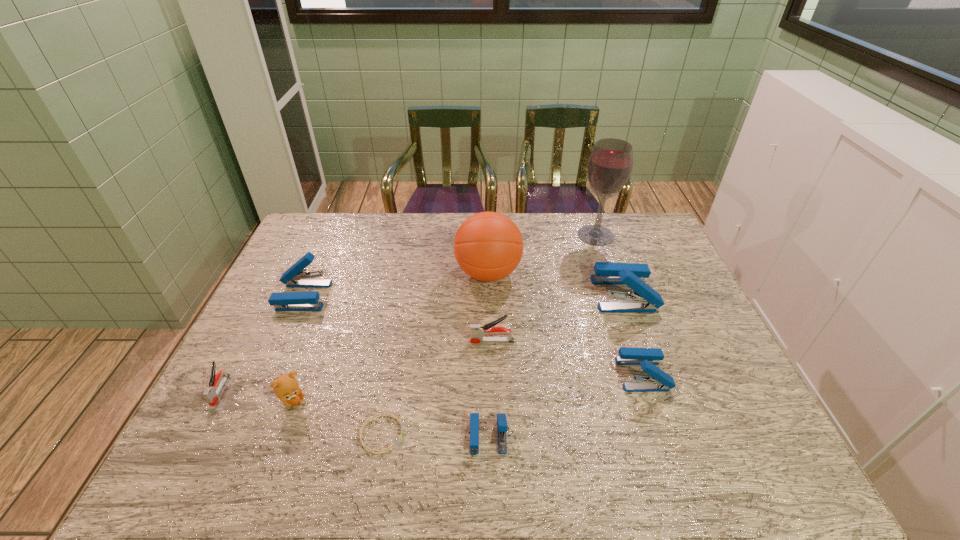
Locate an element on the screen. This screenshot has width=960, height=540. free spot between the smaller gray stapler and the red alcohol is located at coordinates (408, 313).

The width and height of the screenshot is (960, 540). I want to click on vacant area between the right gray stapler and the fourth object from left to right, so click(x=437, y=388).

Find the location of `vacant space in between the brown teddy bear and the third smallest blue stapler`. vacant space in between the brown teddy bear and the third smallest blue stapler is located at coordinates (298, 348).

Identify the location of blank region between the leftmost object and the third farthest stapler. This screenshot has width=960, height=540. (356, 366).

Find the location of a particular element. The height and width of the screenshot is (540, 960). empty space between the smallest blue stapler and the alcohol is located at coordinates (542, 335).

Locate an element on the screen. free spot between the tallest stapler and the bracelet is located at coordinates (502, 364).

Find the location of `free space that is in between the smallest blue stapler and the shortest object`. free space that is in between the smallest blue stapler and the shortest object is located at coordinates pos(435,435).

Image resolution: width=960 pixels, height=540 pixels. I want to click on the sixth closest object to the biggest blue stapler, so click(x=381, y=414).

Locate which object ranks eighth in proximity to the eighth shortest object. Please provide its 2D coordinates. Your answer should be formatted as a tuple, i.e. [(x, y)], where the tuple contains the x and y coordinates of a point satisfying the conditions above.

[(286, 388)]

Find the location of a particular element. This screenshot has height=540, width=960. stapler that can be found as the sixth closest to the brown teddy bear is located at coordinates (644, 299).